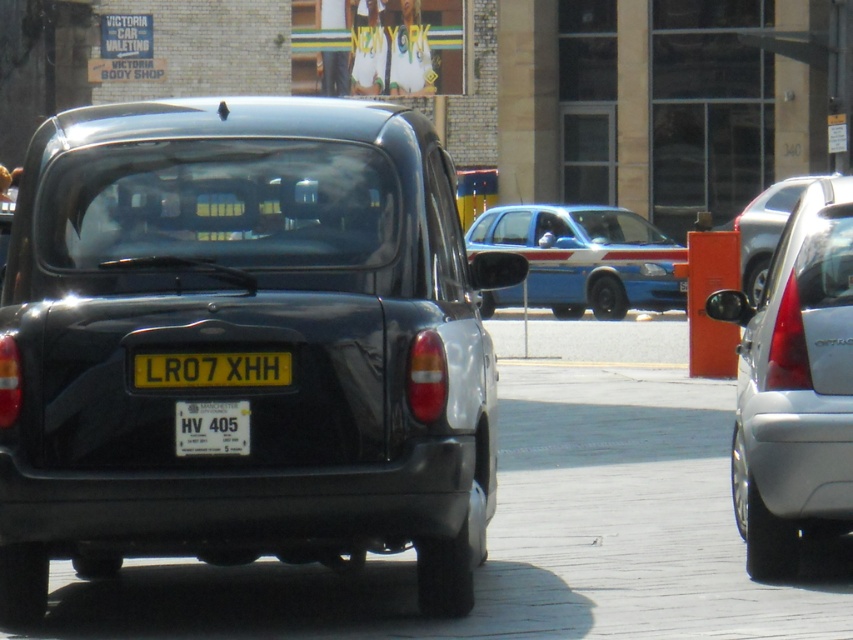
You are a delivery driver needing to park your 2.5m wide van between the matte black car at center and the satin silver sedan at right. Can your van fit in the space between them?

The matte black car at center is wider than the satin silver sedan at right, so the space between them may be sufficient for your 2.5m wide van. However, since the exact distance isn

You are a pedestrian standing on the sidewalk looking at the street. You see a matte black car at center and a blue glossy car at center. Which car is positioned lower in the image?

The matte black car at center is below the blue glossy car at center, so it is positioned lower in the image.